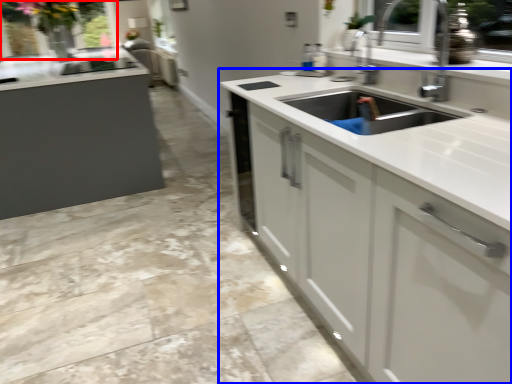
Question: Which of the following is the farthest to the observer, window screen (highlighted by a red box) or countertop (highlighted by a blue box)?

Choices:
 (A) window screen
 (B) countertop

Answer: (A)